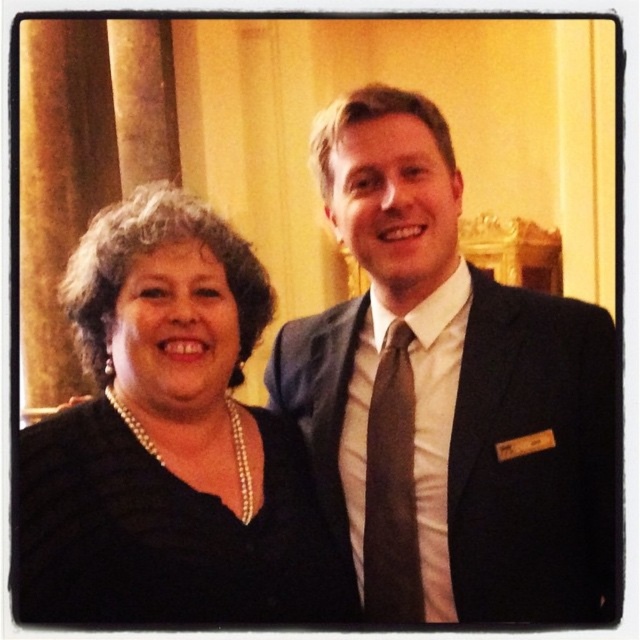
Can you confirm if matte black suit at center is thinner than pearl necklace at left?

Yes.

Does point (390, 241) come in front of point (168, 278)?

No, (390, 241) is behind (168, 278).

Locate an element on the screen. matte black suit at center is located at coordinates tap(448, 394).

Which is above, matte black suit at center or brown silk tie at center?

brown silk tie at center is above.

Is matte black suit at center above brown silk tie at center?

Actually, matte black suit at center is below brown silk tie at center.

What do you see at coordinates (448, 394) in the screenshot? I see `matte black suit at center` at bounding box center [448, 394].

This screenshot has height=640, width=640. Identify the location of matte black suit at center. (448, 394).

Who is positioned more to the right, pearl necklace at left or brown silk tie at center?

brown silk tie at center is more to the right.

Is pearl necklace at left below brown silk tie at center?

Actually, pearl necklace at left is above brown silk tie at center.

This screenshot has width=640, height=640. Describe the element at coordinates (170, 442) in the screenshot. I see `pearl necklace at left` at that location.

The image size is (640, 640). Identify the location of pearl necklace at left. (170, 442).